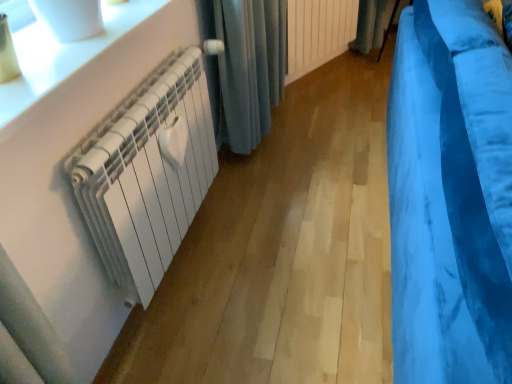
Question: Does white glossy radiator at upper left have a greater height compared to white matte radiator at center, which ranks as the 2th radiator in front-to-back order?

Choices:
 (A) yes
 (B) no

Answer: (B)

Question: From a real-world perspective, is white glossy radiator at upper left physically below white matte radiator at center, the second radiator when ordered from left to right?

Choices:
 (A) yes
 (B) no

Answer: (B)

Question: Can you confirm if white glossy radiator at upper left is positioned to the left of white matte radiator at center, acting as the first radiator starting from the back?

Choices:
 (A) yes
 (B) no

Answer: (A)

Question: Is white glossy radiator at upper left thinner than white matte radiator at center, acting as the first radiator starting from the back?

Choices:
 (A) yes
 (B) no

Answer: (B)

Question: Is the surface of white glossy radiator at upper left in direct contact with white matte radiator at center, the 1th radiator positioned from the right?

Choices:
 (A) yes
 (B) no

Answer: (B)

Question: In terms of height, does white matte radiator at left, which appears as the first radiator when viewed from the front, look taller or shorter compared to white glossy radiator at upper left?

Choices:
 (A) tall
 (B) short

Answer: (A)

Question: Looking at the image, does white matte radiator at left, which appears as the first radiator when viewed from the front, seem bigger or smaller compared to white glossy radiator at upper left?

Choices:
 (A) small
 (B) big

Answer: (B)

Question: In the image, is white matte radiator at left, which appears as the first radiator when ordered from the bottom, positioned in front of or behind white glossy radiator at upper left?

Choices:
 (A) front
 (B) behind

Answer: (B)

Question: In terms of width, does white matte radiator at left, placed as the 1th radiator when sorted from left to right, look wider or thinner when compared to white glossy radiator at upper left?

Choices:
 (A) thin
 (B) wide

Answer: (A)

Question: In the image, is white matte radiator at center, the 1th radiator positioned from the right, positioned in front of or behind velvet blue curtain at right, acting as the second curtain starting from the back?

Choices:
 (A) front
 (B) behind

Answer: (B)

Question: Considering the positions of white matte radiator at center, the second radiator when ordered from left to right, and velvet blue curtain at right, which is the 1th curtain from front to back, in the image, is white matte radiator at center, the second radiator when ordered from left to right, taller or shorter than velvet blue curtain at right, which is the 1th curtain from front to back,?

Choices:
 (A) short
 (B) tall

Answer: (A)

Question: Considering the positions of white matte radiator at center, the second radiator ordered from the bottom, and velvet blue curtain at right, marked as the second curtain in a top-to-bottom arrangement, in the image, is white matte radiator at center, the second radiator ordered from the bottom, wider or thinner than velvet blue curtain at right, marked as the second curtain in a top-to-bottom arrangement,?

Choices:
 (A) thin
 (B) wide

Answer: (A)

Question: Would you say white matte radiator at center, which ranks as the 2th radiator in front-to-back order, is inside or outside velvet blue curtain at right, acting as the second curtain starting from the back?

Choices:
 (A) outside
 (B) inside

Answer: (A)

Question: In terms of height, does blue velvet curtain at upper right, acting as the first curtain starting from the back, look taller or shorter compared to white glossy radiator at upper left?

Choices:
 (A) tall
 (B) short

Answer: (A)

Question: From a real-world perspective, is blue velvet curtain at upper right, acting as the first curtain starting from the back, positioned above or below white glossy radiator at upper left?

Choices:
 (A) below
 (B) above

Answer: (A)